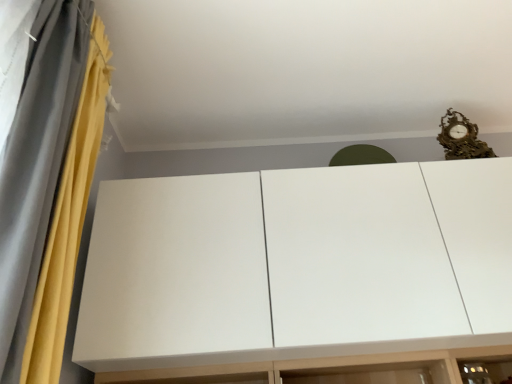
What is the approximate width of white matte cupboard at upper center?

17.43 inches.

Find the location of a particular element. The width and height of the screenshot is (512, 384). white matte cupboard at upper center is located at coordinates (298, 264).

Describe the element at coordinates (298, 264) in the screenshot. I see `white matte cupboard at upper center` at that location.

What do you see at coordinates (68, 221) in the screenshot? I see `yellow fabric curtain at left` at bounding box center [68, 221].

Find the location of `yellow fabric curtain at left`. yellow fabric curtain at left is located at coordinates (68, 221).

Locate an element on the screen. The height and width of the screenshot is (384, 512). white matte cupboard at upper center is located at coordinates (298, 264).

Would you say white matte cupboard at upper center is to the left or to the right of yellow fabric curtain at left in the picture?

In the image, white matte cupboard at upper center appears on the right side of yellow fabric curtain at left.

Which object is closer to the camera, white matte cupboard at upper center or yellow fabric curtain at left?

yellow fabric curtain at left.

Is point (370, 224) less distant than point (61, 191)?

No.

From the image's perspective, which is below, white matte cupboard at upper center or yellow fabric curtain at left?

white matte cupboard at upper center appears lower in the image.

From a real-world perspective, is white matte cupboard at upper center below yellow fabric curtain at left?

Yes, from a real-world perspective, white matte cupboard at upper center is under yellow fabric curtain at left.

Can you confirm if white matte cupboard at upper center is thinner than yellow fabric curtain at left?

Incorrect, the width of white matte cupboard at upper center is not less than that of yellow fabric curtain at left.

Considering the sizes of objects white matte cupboard at upper center and yellow fabric curtain at left in the image provided, who is taller, white matte cupboard at upper center or yellow fabric curtain at left?

Standing taller between the two is yellow fabric curtain at left.

Can you confirm if white matte cupboard at upper center is bigger than yellow fabric curtain at left?

Yes.

Consider the image. Is yellow fabric curtain at left surrounded by white matte cupboard at upper center?

No, yellow fabric curtain at left is not a part of white matte cupboard at upper center.

Consider the image. Is white matte cupboard at upper center not close to yellow fabric curtain at left?

No, white matte cupboard at upper center is not far from yellow fabric curtain at left.

Is yellow fabric curtain at left at the back of white matte cupboard at upper center?

No, yellow fabric curtain at left is not at the back of white matte cupboard at upper center.

Identify the location of cupboard directly beneath the yellow fabric curtain at left (from a real-world perspective). This screenshot has height=384, width=512. [298, 264].

Considering the positions of objects yellow fabric curtain at left and white matte cupboard at upper center in the image provided, who is more to the left, yellow fabric curtain at left or white matte cupboard at upper center?

yellow fabric curtain at left is more to the left.

In the image, is yellow fabric curtain at left positioned in front of or behind white matte cupboard at upper center?

yellow fabric curtain at left is in front of white matte cupboard at upper center.

Which is less distant, (65,195) or (103,195)?

The point (65,195) is more forward.

From the image's perspective, is yellow fabric curtain at left located above or below white matte cupboard at upper center?

Clearly, from the image's perspective, yellow fabric curtain at left is above white matte cupboard at upper center.

From a real-world perspective, who is located higher, yellow fabric curtain at left or white matte cupboard at upper center?

yellow fabric curtain at left, from a real-world perspective.

Does yellow fabric curtain at left have a greater width compared to white matte cupboard at upper center?

Incorrect, the width of yellow fabric curtain at left does not surpass that of white matte cupboard at upper center.

Which of these two, yellow fabric curtain at left or white matte cupboard at upper center, stands shorter?

white matte cupboard at upper center.

Considering the relative sizes of yellow fabric curtain at left and white matte cupboard at upper center in the image provided, is yellow fabric curtain at left bigger than white matte cupboard at upper center?

No.

Is white matte cupboard at upper center surrounded by yellow fabric curtain at left?

Definitely not — white matte cupboard at upper center is not inside yellow fabric curtain at left.

Is yellow fabric curtain at left positioned far away from white matte cupboard at upper center?

No, yellow fabric curtain at left is in close proximity to white matte cupboard at upper center.

Is yellow fabric curtain at left oriented towards white matte cupboard at upper center?

No, yellow fabric curtain at left is not turned towards white matte cupboard at upper center.

Can you tell me how much yellow fabric curtain at left and white matte cupboard at upper center differ in facing direction?

The angular difference between yellow fabric curtain at left and white matte cupboard at upper center is 93.2 degrees.

This screenshot has width=512, height=384. Identify the location of cupboard below the yellow fabric curtain at left (from the image's perspective). (298, 264).

I want to click on curtain in front of the white matte cupboard at upper center, so click(x=68, y=221).

This screenshot has width=512, height=384. What are the coordinates of `cupboard on the right side of yellow fabric curtain at left` in the screenshot? It's located at (298, 264).